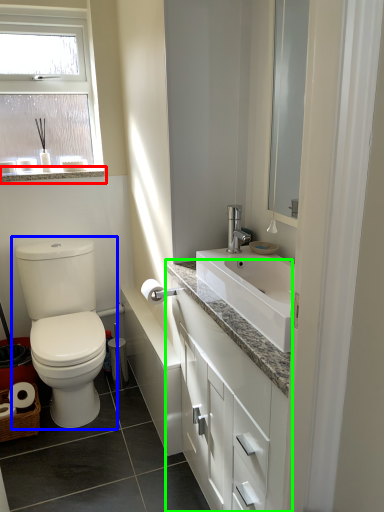
Question: Which is farther away from window sill (highlighted by a red box)? toilet (highlighted by a blue box) or bathroom cabinet (highlighted by a green box)?

Choices:
 (A) toilet
 (B) bathroom cabinet

Answer: (B)